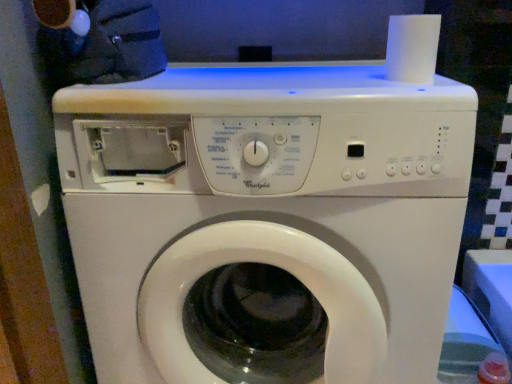
The height and width of the screenshot is (384, 512). I want to click on white plastic washing machine at center, so point(266,221).

Describe the element at coordinates (266, 221) in the screenshot. I see `white plastic washing machine at center` at that location.

What is the approximate width of white plastic washing machine at center?

It is 24.79 inches.

The image size is (512, 384). What are the coordinates of `white matte paper towel at upper right` in the screenshot? It's located at (412, 48).

The height and width of the screenshot is (384, 512). Describe the element at coordinates (412, 48) in the screenshot. I see `white matte paper towel at upper right` at that location.

Where is `white plastic washing machine at center`? The image size is (512, 384). white plastic washing machine at center is located at coordinates pos(266,221).

Which is more to the left, white plastic washing machine at center or white matte paper towel at upper right?

Positioned to the left is white plastic washing machine at center.

Is white plastic washing machine at center behind white matte paper towel at upper right?

No, white plastic washing machine at center is closer to the camera.

Which is behind, point (318, 300) or point (439, 26)?

The point (439, 26) is farther.

From the image's perspective, is white plastic washing machine at center on top of white matte paper towel at upper right?

No, from the image's perspective, white plastic washing machine at center is not over white matte paper towel at upper right.

From a real-world perspective, which object rests below the other?

In real-world perspective, white plastic washing machine at center is lower.

Between white plastic washing machine at center and white matte paper towel at upper right, which one has larger width?

white plastic washing machine at center is wider.

Who is shorter, white plastic washing machine at center or white matte paper towel at upper right?

white matte paper towel at upper right.

Does white plastic washing machine at center have a larger size compared to white matte paper towel at upper right?

Yes.

Choose the correct answer: Is white plastic washing machine at center inside white matte paper towel at upper right or outside it?

white plastic washing machine at center is spatially situated outside white matte paper towel at upper right.

Is white plastic washing machine at center next to white matte paper towel at upper right and touching it?

white plastic washing machine at center and white matte paper towel at upper right are clearly separated.

Could you tell me if white plastic washing machine at center is facing white matte paper towel at upper right?

No, white plastic washing machine at center is not aimed at white matte paper towel at upper right.

How different are the orientations of white plastic washing machine at center and white matte paper towel at upper right in degrees?

There is a 0.0284-degree angle between the facing directions of white plastic washing machine at center and white matte paper towel at upper right.

Looking at this image, how distant is white plastic washing machine at center from white matte paper towel at upper right?

A distance of 35.77 centimeters exists between white plastic washing machine at center and white matte paper towel at upper right.

In order to click on paper towel that is on the right side of white plastic washing machine at center in this screenshot , I will do `click(412, 48)`.

Would you say white matte paper towel at upper right is to the left or to the right of white plastic washing machine at center in the picture?

Clearly, white matte paper towel at upper right is on the right of white plastic washing machine at center in the image.

Does white matte paper towel at upper right lie in front of white plastic washing machine at center?

No, white matte paper towel at upper right is behind white plastic washing machine at center.

Which is in front, point (437, 22) or point (371, 254)?

The point (437, 22) is closer.

From the image's perspective, relative to white plastic washing machine at center, is white matte paper towel at upper right above or below?

Based on their image positions, white matte paper towel at upper right is located above white plastic washing machine at center.

From a real-world perspective, which object rests below the other?

white plastic washing machine at center is physically lower.

Is white matte paper towel at upper right wider or thinner than white plastic washing machine at center?

Clearly, white matte paper towel at upper right has less width compared to white plastic washing machine at center.

Does white matte paper towel at upper right have a lesser height compared to white plastic washing machine at center?

Indeed, white matte paper towel at upper right has a lesser height compared to white plastic washing machine at center.

Does white matte paper towel at upper right have a larger size compared to white plastic washing machine at center?

No.

From the picture: Would you say white matte paper towel at upper right is outside white plastic washing machine at center?

Yes.

Is white matte paper towel at upper right next to white plastic washing machine at center and touching it?

There is a gap between white matte paper towel at upper right and white plastic washing machine at center.

Is white matte paper towel at upper right oriented away from white plastic washing machine at center?

white matte paper towel at upper right does not have its back to white plastic washing machine at center.

How different are the orientations of white matte paper towel at upper right and white plastic washing machine at center in degrees?

The angle between the facing direction of white matte paper towel at upper right and the facing direction of white plastic washing machine at center is 0.0284 degrees.

From the picture: How distant is white matte paper towel at upper right from white plastic washing machine at center?

white matte paper towel at upper right and white plastic washing machine at center are 14.08 inches apart.

This screenshot has width=512, height=384. Find the location of `washing machine in front of the white matte paper towel at upper right`. washing machine in front of the white matte paper towel at upper right is located at coordinates (266, 221).

Where is `washing machine below the white matte paper towel at upper right (from a real-world perspective)`? The height and width of the screenshot is (384, 512). washing machine below the white matte paper towel at upper right (from a real-world perspective) is located at coordinates (266, 221).

Locate an element on the screen. This screenshot has height=384, width=512. washing machine in front of the white matte paper towel at upper right is located at coordinates (266, 221).